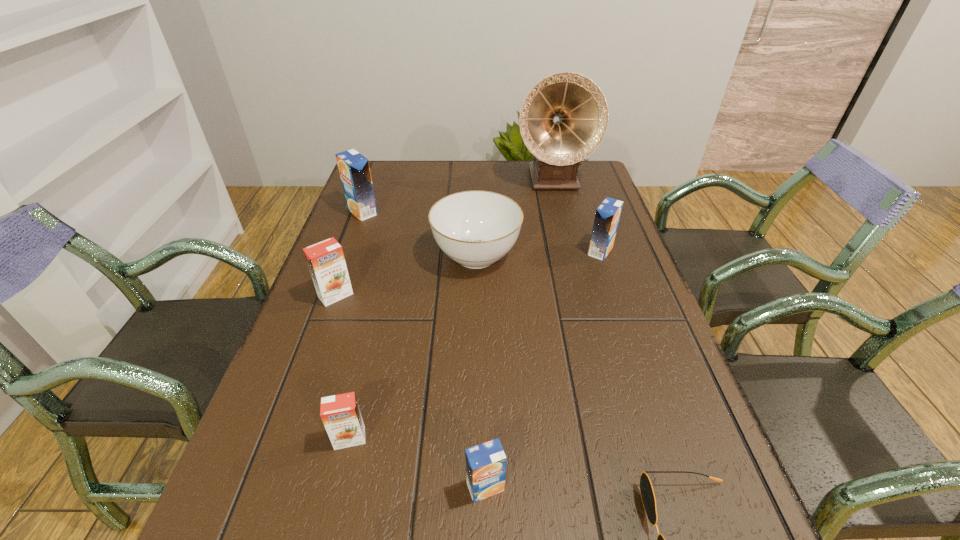
In order to click on blank space that satisfies the following two spatial constraints: 1. on the front side of the second tallest object; 2. on the left side of the second farthest orange_juice in this screenshot , I will do `click(348, 251)`.